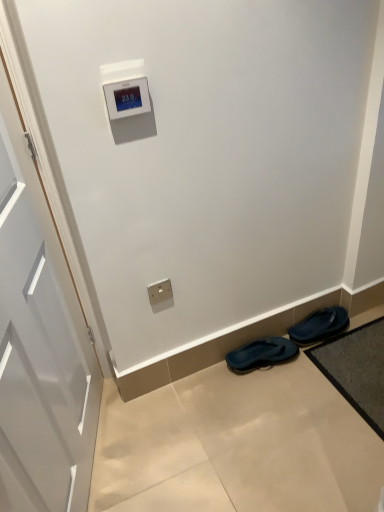
Locate an element on the screen. This screenshot has height=512, width=384. spots to the right of dark blue rubber flip-flops at lower right, the 1th footwear viewed from the left is located at coordinates (314, 370).